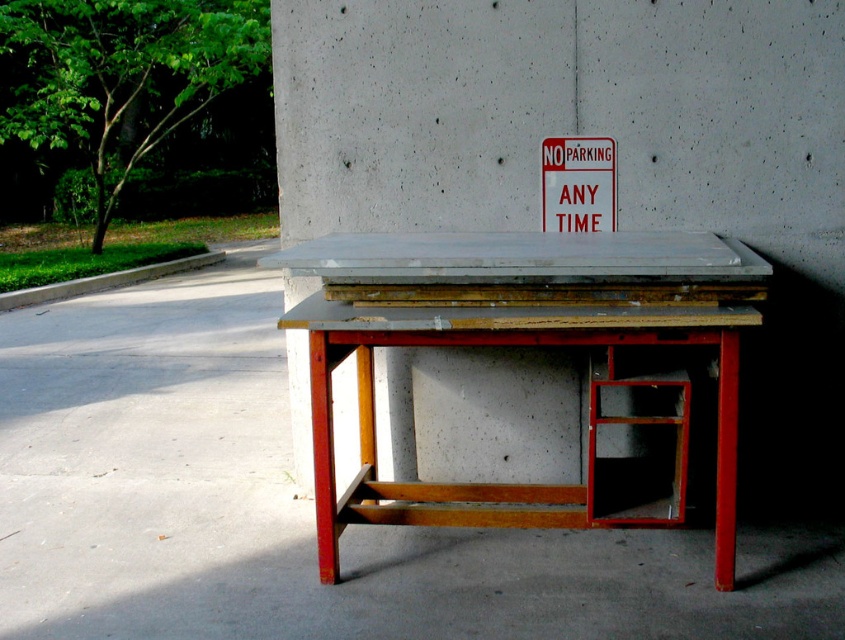
Question: From the image, what is the correct spatial relationship of wooden table at center in relation to white plastic sign at upper center?

Choices:
 (A) left
 (B) right

Answer: (A)

Question: Which point is farther to the camera?

Choices:
 (A) white plastic sign at upper center
 (B) smooth concrete pillar at center
 (C) wooden table at center

Answer: (A)

Question: Does wooden table at center have a smaller size compared to white plastic sign at upper center?

Choices:
 (A) yes
 (B) no

Answer: (B)

Question: Is smooth concrete pillar at center positioned before white plastic sign at upper center?

Choices:
 (A) yes
 (B) no

Answer: (A)

Question: Which of these objects is positioned closest to the smooth concrete pillar at center?

Choices:
 (A) white plastic sign at upper center
 (B) wooden table at center

Answer: (A)

Question: Which point appears closest to the camera in this image?

Choices:
 (A) (413, 19)
 (B) (320, 444)

Answer: (B)